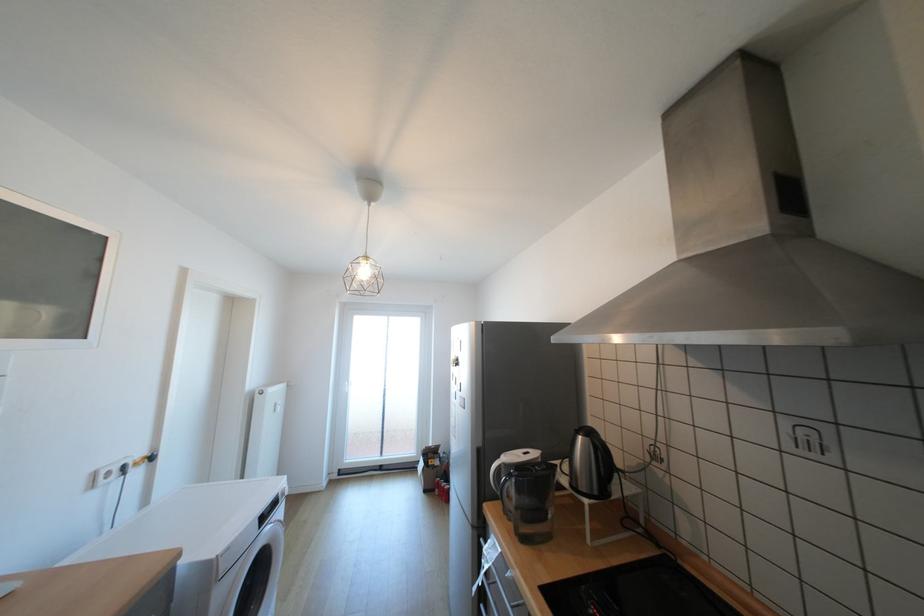
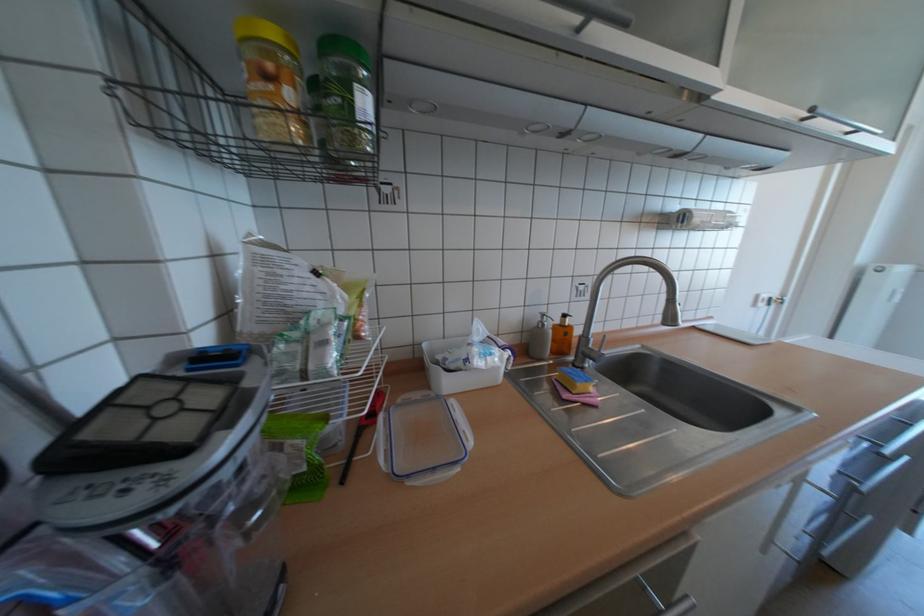
Based on the continuous images, in which direction is the camera rotating?

The camera rotated toward left-down.